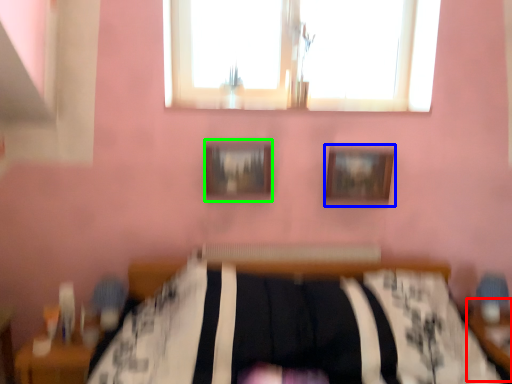
Question: Considering the real-world distances, which object is closest to table (highlighted by a red box)? picture frame (highlighted by a blue box) or picture frame (highlighted by a green box).

Choices:
 (A) picture frame
 (B) picture frame

Answer: (A)